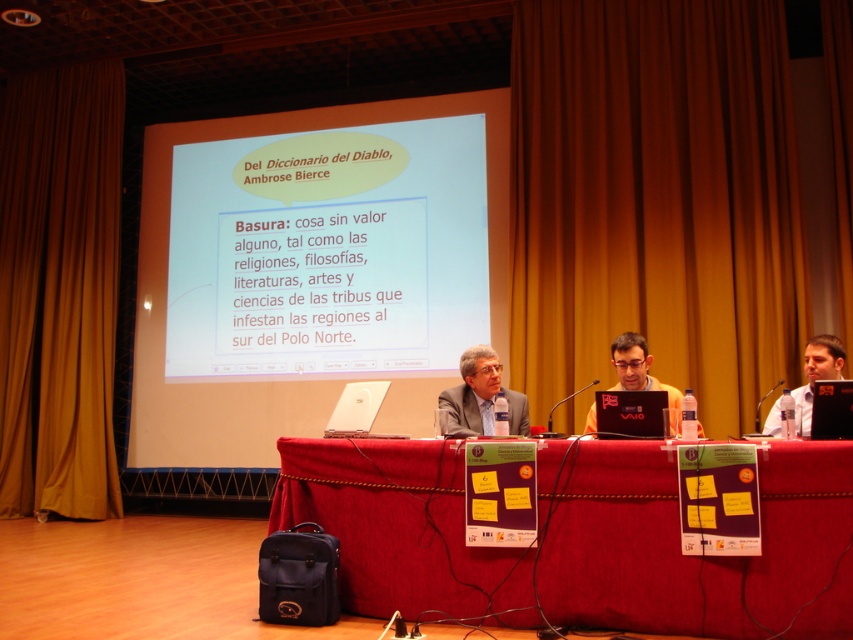
Question: Does brown velvet curtain at upper center appear on the left side of red fabric table at lower center?

Choices:
 (A) yes
 (B) no

Answer: (B)

Question: Considering the relative positions of white glossy projector screen at upper center and red fabric table at lower center in the image provided, where is white glossy projector screen at upper center located with respect to red fabric table at lower center?

Choices:
 (A) above
 (B) below

Answer: (A)

Question: Among these points, which one is farthest from the camera?

Choices:
 (A) (171, 410)
 (B) (0, 476)
 (C) (466, 353)

Answer: (A)

Question: Which point is farther from the camera taking this photo?

Choices:
 (A) (553, 582)
 (B) (637, 252)
 (C) (799, 410)
 (D) (671, 403)

Answer: (B)

Question: Which object is the closest to the brown velvet curtain at upper center?

Choices:
 (A) matte black laptop at right
 (B) matte black laptop at center
 (C) red fabric table at lower center

Answer: (B)

Question: Is brown velvet curtain at left below matte black laptop at right?

Choices:
 (A) yes
 (B) no

Answer: (B)